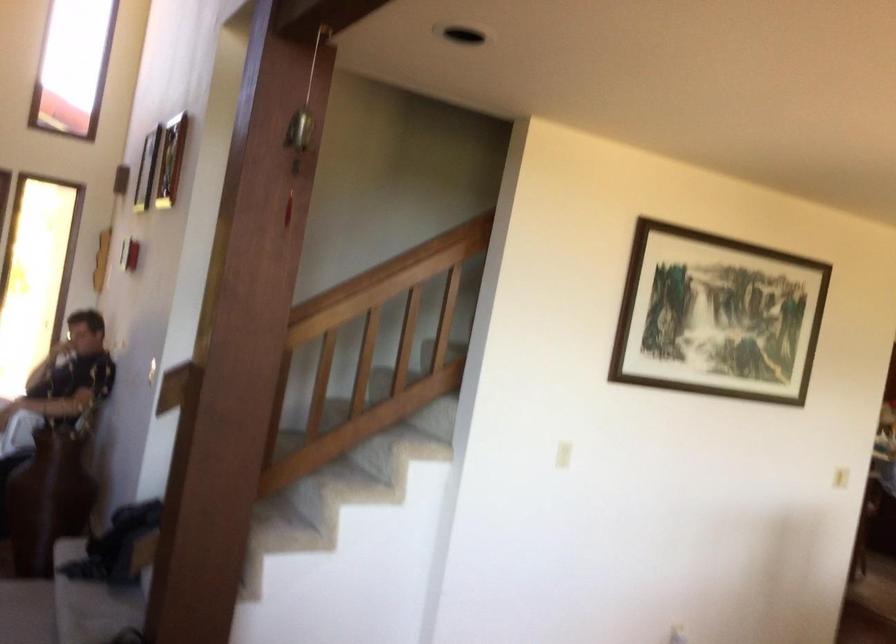
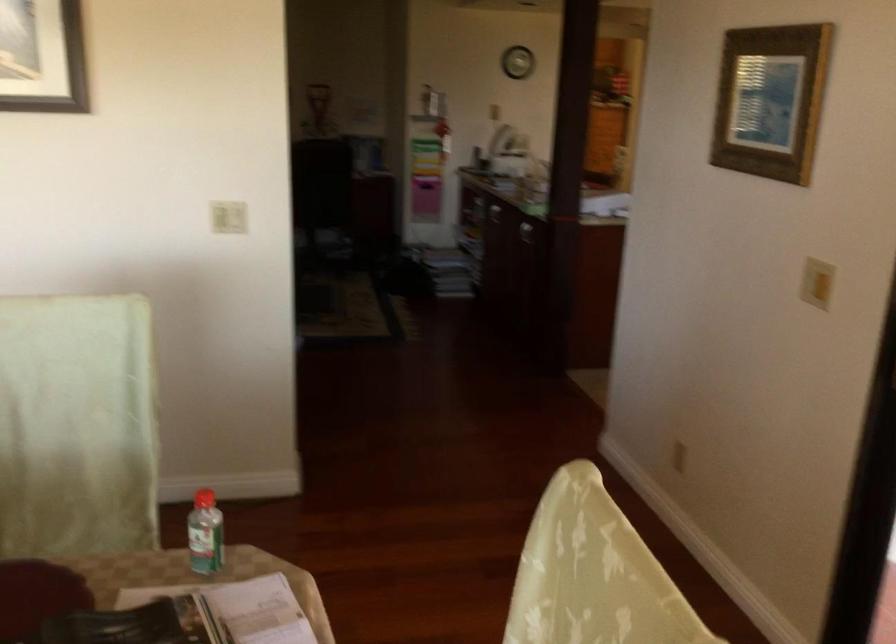
In a continuous first-person perspective shot, in which direction is the camera moving?

The movement direction of the cameraman is right, forward.